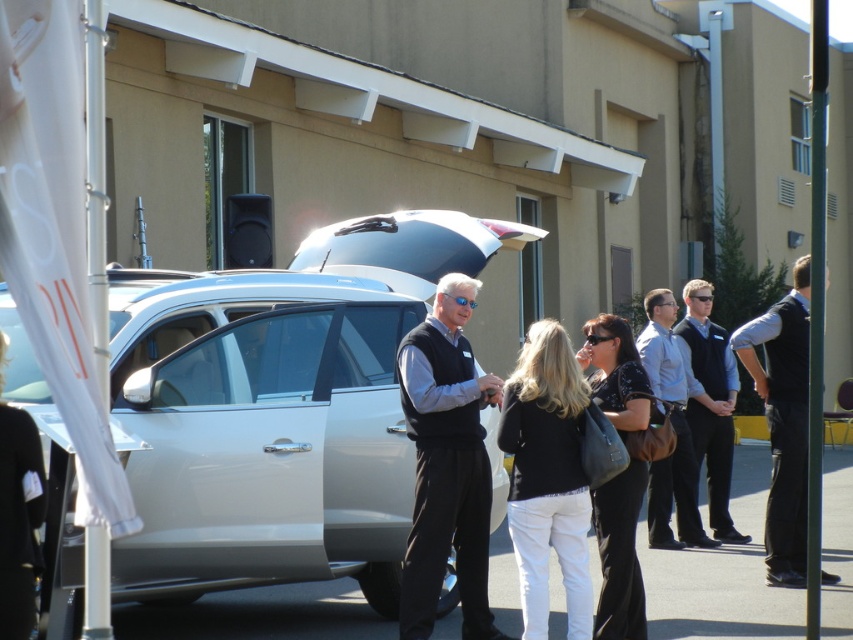
Does satin silver car at center appear on the right side of black fabric coat at center?

Yes, satin silver car at center is to the right of black fabric coat at center.

Can you confirm if satin silver car at center is bigger than black fabric coat at center?

Correct, satin silver car at center is larger in size than black fabric coat at center.

This screenshot has height=640, width=853. I want to click on satin silver car at center, so click(280, 406).

Between satin silver car at center and black matte vest at center, which one appears on the right side from the viewer's perspective?

From the viewer's perspective, black matte vest at center appears more on the right side.

Is point (177, 330) farther from camera compared to point (416, 605)?

Yes, it is behind point (416, 605).

Locate an element on the screen. The width and height of the screenshot is (853, 640). satin silver car at center is located at coordinates (280, 406).

Is black matte sweater at center in front of dark blue vest at center?

Yes, black matte sweater at center is closer to the viewer.

Where is `black matte sweater at center`? The width and height of the screenshot is (853, 640). black matte sweater at center is located at coordinates (547, 477).